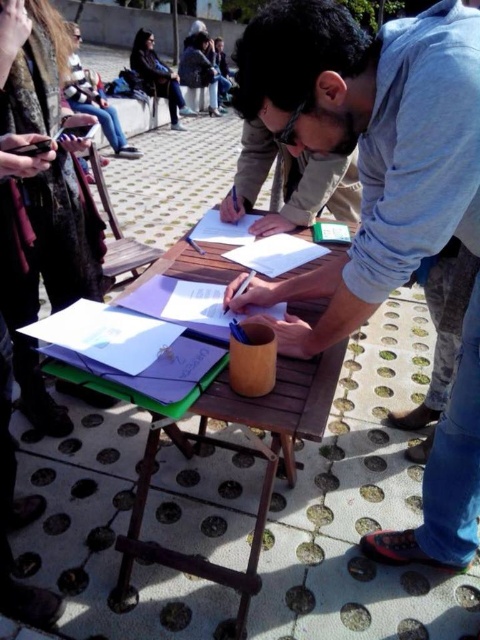
You are a person who wants to place a 12 inch long book on the wooden picnic table at center. Can you fit it there?

The wooden picnic table at center has enough space since the objects on it are 35.82 inches apart, which is more than the book length of 12 inches.

You are standing in the scene and want to place a small plant between the two points, point [324,141] and point [135,44]. Which point should the plant be closer to in order to be nearer to the viewer?

The plant should be closer to point [324,141] because it is closer to the viewer than point [135,44].